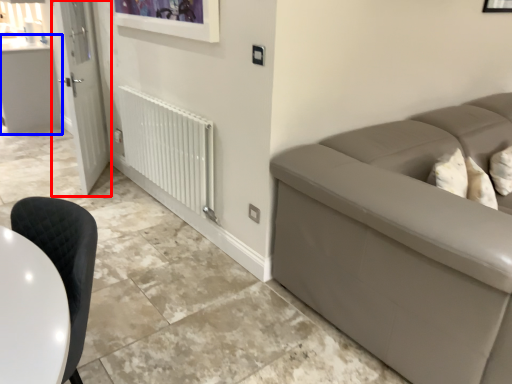
Question: Among these objects, which one is farthest to the camera, door (highlighted by a red box) or counter top (highlighted by a blue box)?

Choices:
 (A) door
 (B) counter top

Answer: (B)